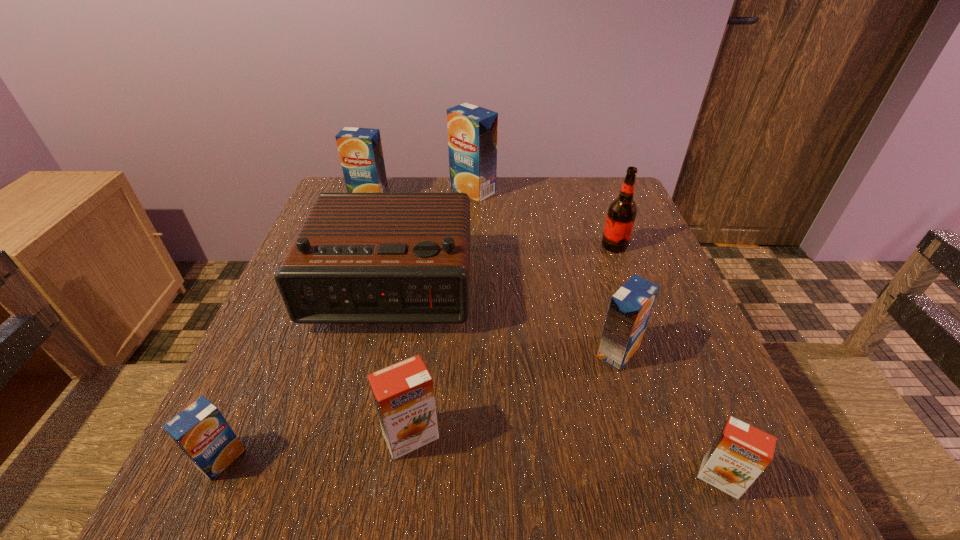
The image size is (960, 540). In order to click on the right orange orange juice in this screenshot , I will do `click(740, 452)`.

Where is `free spot located 0.400m on the front of the tallest orange juice`? The height and width of the screenshot is (540, 960). free spot located 0.400m on the front of the tallest orange juice is located at coordinates (470, 313).

Image resolution: width=960 pixels, height=540 pixels. Find the location of `vacant space located on the back of the root beer`. vacant space located on the back of the root beer is located at coordinates (591, 185).

Image resolution: width=960 pixels, height=540 pixels. What are the coordinates of `vacant space located on the back of the third smallest blue orange_juice` in the screenshot? It's located at (376, 179).

Identify the location of vacant space located on the front panel of the radio receiver. (337, 502).

Locate an element on the screen. The height and width of the screenshot is (540, 960). free point located 0.180m on the front of the rightmost blue orange_juice is located at coordinates (656, 477).

In order to click on vacant space located 0.070m on the front of the left orange orange juice in this screenshot , I will do (x=401, y=512).

Where is `vacant area situated 0.120m on the right of the nearest blue orange_juice`? The image size is (960, 540). vacant area situated 0.120m on the right of the nearest blue orange_juice is located at coordinates (326, 459).

At what (x,y) coordinates should I click in order to perform the action: click on blank space located on the left of the smaller orange orange juice. Please return your answer as a coordinate pair (x, y). This screenshot has height=540, width=960. Looking at the image, I should click on tap(544, 478).

Find the location of a particular element. radio receiver present at the left edge is located at coordinates (358, 258).